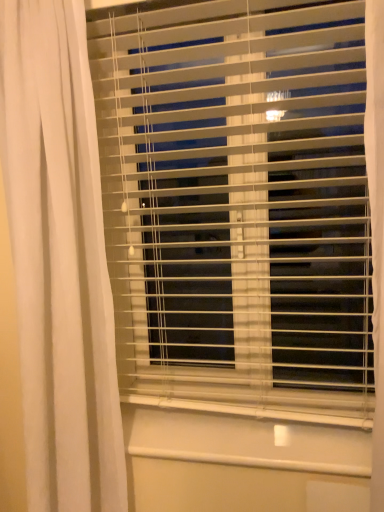
Measure the distance between point [269,177] and camera.

Point [269,177] and camera are 1.23 meters apart from each other.

The image size is (384, 512). What do you see at coordinates (237, 204) in the screenshot?
I see `white plastic blinds at center` at bounding box center [237, 204].

Consider the image. What is the approximate width of white plastic blinds at center?

white plastic blinds at center is 3.33 inches wide.

Find the location of a particular element. This screenshot has height=512, width=384. white plastic blinds at center is located at coordinates (237, 204).

This screenshot has height=512, width=384. I want to click on white plastic blinds at center, so click(x=237, y=204).